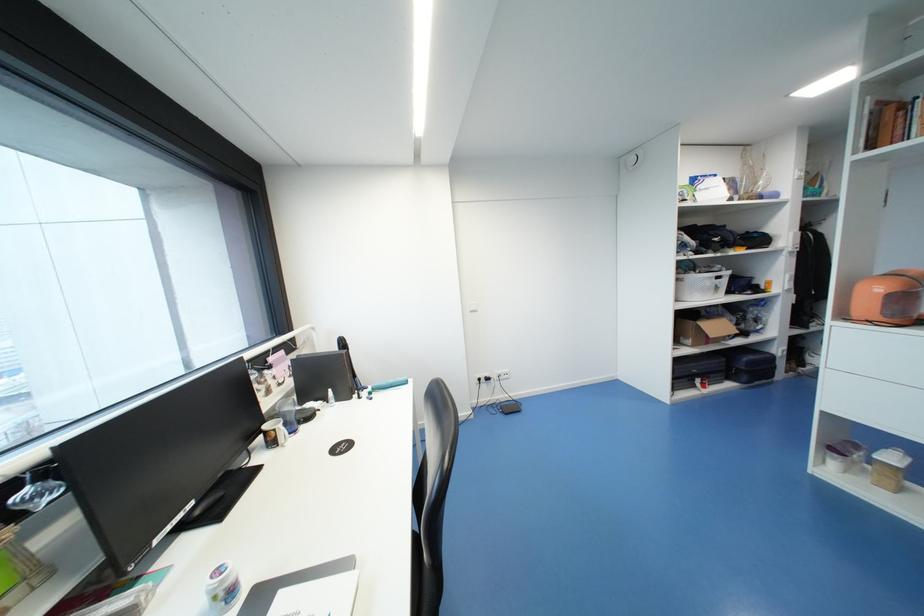
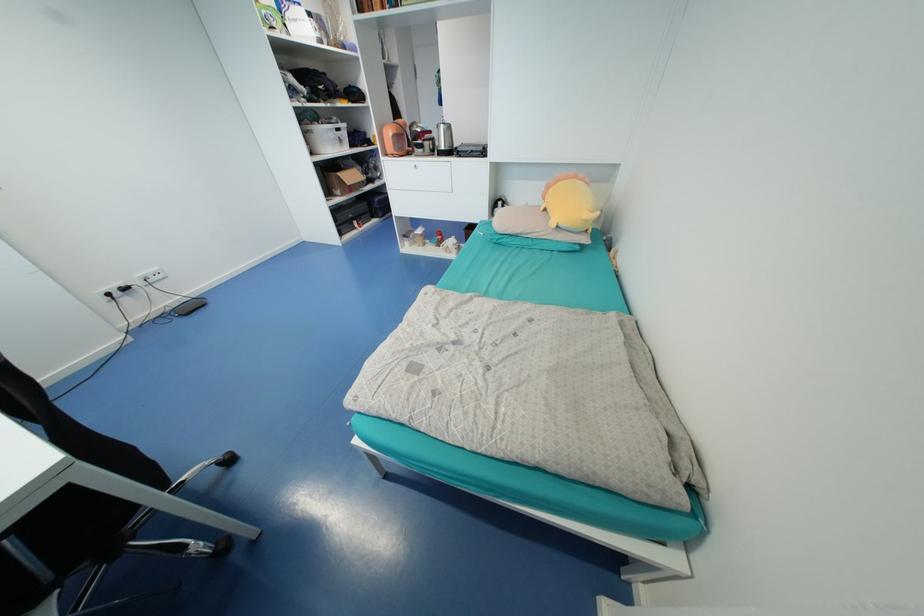
Find the pixel in the second image that matches point (690, 339) in the first image.

(341, 190)